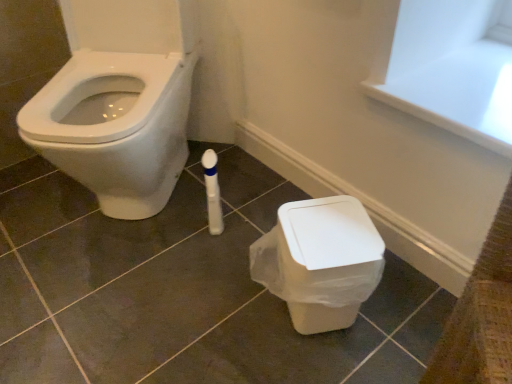
You are a GUI agent. You are given a task and a screenshot of the screen. Output one action in this format:
    pyautogui.click(x=<x>, y=<y>)
    Task: Click on the vacant space situated on the left part of white glossy bidet at left
    The width and height of the screenshot is (512, 384).
    Given the screenshot: What is the action you would take?
    pyautogui.click(x=33, y=196)